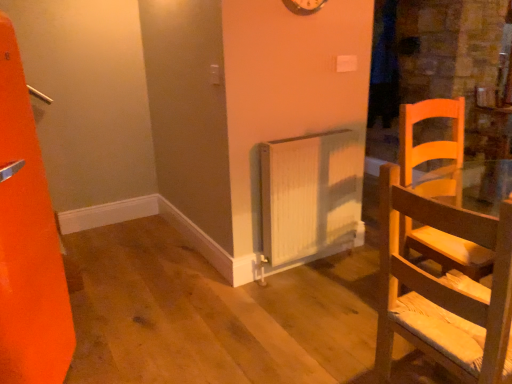
Question: Does metallic silver clock at upper center have a greater width compared to white ribbed radiator at center?

Choices:
 (A) yes
 (B) no

Answer: (B)

Question: Is metallic silver clock at upper center shorter than white ribbed radiator at center?

Choices:
 (A) yes
 (B) no

Answer: (A)

Question: Is metallic silver clock at upper center aimed at white ribbed radiator at center?

Choices:
 (A) no
 (B) yes

Answer: (A)

Question: Does metallic silver clock at upper center have a lesser width compared to white ribbed radiator at center?

Choices:
 (A) no
 (B) yes

Answer: (B)

Question: Is metallic silver clock at upper center bigger than white ribbed radiator at center?

Choices:
 (A) yes
 (B) no

Answer: (B)

Question: From the image's perspective, is metallic silver clock at upper center above white ribbed radiator at center?

Choices:
 (A) no
 (B) yes

Answer: (B)

Question: Does white ribbed radiator at center have a greater width compared to metallic silver clock at upper center?

Choices:
 (A) yes
 (B) no

Answer: (A)

Question: Is the surface of white ribbed radiator at center in direct contact with metallic silver clock at upper center?

Choices:
 (A) yes
 (B) no

Answer: (B)

Question: Considering the relative positions of white ribbed radiator at center and metallic silver clock at upper center in the image provided, is white ribbed radiator at center to the left of metallic silver clock at upper center from the viewer's perspective?

Choices:
 (A) yes
 (B) no

Answer: (B)

Question: Is white ribbed radiator at center closer to the viewer compared to metallic silver clock at upper center?

Choices:
 (A) no
 (B) yes

Answer: (A)

Question: Can you confirm if white ribbed radiator at center is bigger than metallic silver clock at upper center?

Choices:
 (A) yes
 (B) no

Answer: (A)

Question: Is white ribbed radiator at center shorter than metallic silver clock at upper center?

Choices:
 (A) no
 (B) yes

Answer: (A)

Question: Is white ribbed radiator at center positioned in front of light wood chair at right?

Choices:
 (A) no
 (B) yes

Answer: (A)